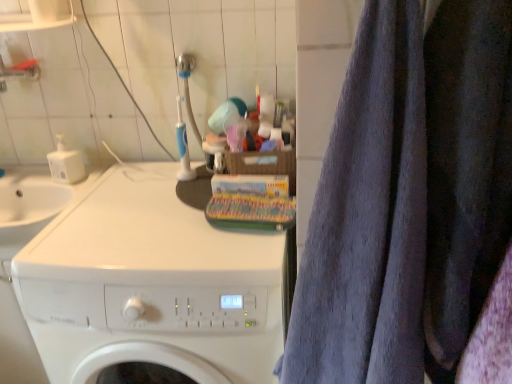
This screenshot has height=384, width=512. I want to click on dark blue fabric at right, so click(465, 170).

Locate an element on the screen. gray terry cloth towel at right is located at coordinates (368, 218).

What's the angular difference between dark blue fabric at right and white glossy washing machine at center's facing directions?

The angular difference between dark blue fabric at right and white glossy washing machine at center is 0.259 degrees.

Looking at this image, which object is further away from the camera taking this photo, dark blue fabric at right or white glossy washing machine at center?

Positioned behind is white glossy washing machine at center.

Is point (465, 271) positioned in front of point (281, 339)?

Yes.

Is dark blue fabric at right to the right of white glossy washing machine at center from the viewer's perspective?

Indeed, dark blue fabric at right is positioned on the right side of white glossy washing machine at center.

This screenshot has height=384, width=512. I want to click on bath towel located above the white glossy washing machine at center (from a real-world perspective), so click(x=368, y=218).

Do you think white glossy washing machine at center is within gray terry cloth towel at right, or outside of it?

white glossy washing machine at center exists outside the volume of gray terry cloth towel at right.

Does white glossy washing machine at center appear on the left side of gray terry cloth towel at right?

Yes.

Is dark blue fabric at right outside of gray terry cloth towel at right?

Yes, dark blue fabric at right is outside of gray terry cloth towel at right.

From the image's perspective, which one is positioned higher, dark blue fabric at right or gray terry cloth towel at right?

From the image's view, dark blue fabric at right is above.

Which is further, (439, 229) or (396, 181)?

The point (439, 229) is behind.

Does dark blue fabric at right have a lesser height compared to gray terry cloth towel at right?

Yes, dark blue fabric at right is shorter than gray terry cloth towel at right.

Consider the image. Is white glossy washing machine at center oriented towards dark blue fabric at right?

No, white glossy washing machine at center is not oriented towards dark blue fabric at right.

Between point (124, 321) and point (471, 104), which one is positioned in front?

The point (471, 104) is closer to the camera.

Where is `washing machine behind the dark blue fabric at right`? washing machine behind the dark blue fabric at right is located at coordinates (151, 286).

Considering the sizes of objects gray terry cloth towel at right and white glossy washing machine at center in the image provided, who is taller, gray terry cloth towel at right or white glossy washing machine at center?

white glossy washing machine at center is taller.

Which is in front, point (359, 129) or point (202, 289)?

The point (359, 129) is closer.

Is white glossy washing machine at center surrounded by gray terry cloth towel at right?

No, white glossy washing machine at center is not a part of gray terry cloth towel at right.

Would you say gray terry cloth towel at right is a long distance from white glossy washing machine at center?

gray terry cloth towel at right is actually quite close to white glossy washing machine at center.

Can you confirm if gray terry cloth towel at right is shorter than dark blue fabric at right?

No, gray terry cloth towel at right is not shorter than dark blue fabric at right.

Are gray terry cloth towel at right and dark blue fabric at right far apart?

No, gray terry cloth towel at right is not far away from dark blue fabric at right.

Is gray terry cloth towel at right in front of dark blue fabric at right?

Yes, gray terry cloth towel at right is in front of dark blue fabric at right.

Can you tell me how much gray terry cloth towel at right and dark blue fabric at right differ in facing direction?

The angular difference between gray terry cloth towel at right and dark blue fabric at right is 0.000892 degrees.

Find the location of a particular element. washing machine below the dark blue fabric at right (from a real-world perspective) is located at coordinates (151, 286).

Find the location of a particular element. The height and width of the screenshot is (384, 512). bath towel above the white glossy washing machine at center (from the image's perspective) is located at coordinates (368, 218).

Based on their spatial positions, is gray terry cloth towel at right or dark blue fabric at right closer to white glossy washing machine at center?

gray terry cloth towel at right.

Looking at the image, which one is located further to white glossy washing machine at center, dark blue fabric at right or gray terry cloth towel at right?

dark blue fabric at right is positioned further to the anchor white glossy washing machine at center.

From the image, which object appears to be farther from gray terry cloth towel at right, white glossy washing machine at center or dark blue fabric at right?

The object further to gray terry cloth towel at right is white glossy washing machine at center.

Estimate the real-world distances between objects in this image. Which object is further from dark blue fabric at right, gray terry cloth towel at right or white glossy washing machine at center?

white glossy washing machine at center is further to dark blue fabric at right.

Considering their positions, is white glossy washing machine at center positioned further to dark blue fabric at right than gray terry cloth towel at right?

Based on the image, white glossy washing machine at center appears to be further to dark blue fabric at right.

Estimate the real-world distances between objects in this image. Which object is closer to gray terry cloth towel at right, dark blue fabric at right or white glossy washing machine at center?

dark blue fabric at right lies closer to gray terry cloth towel at right than the other object.

Locate an element on the screen. clothing between gray terry cloth towel at right and white glossy washing machine at center along the z-axis is located at coordinates (465, 170).